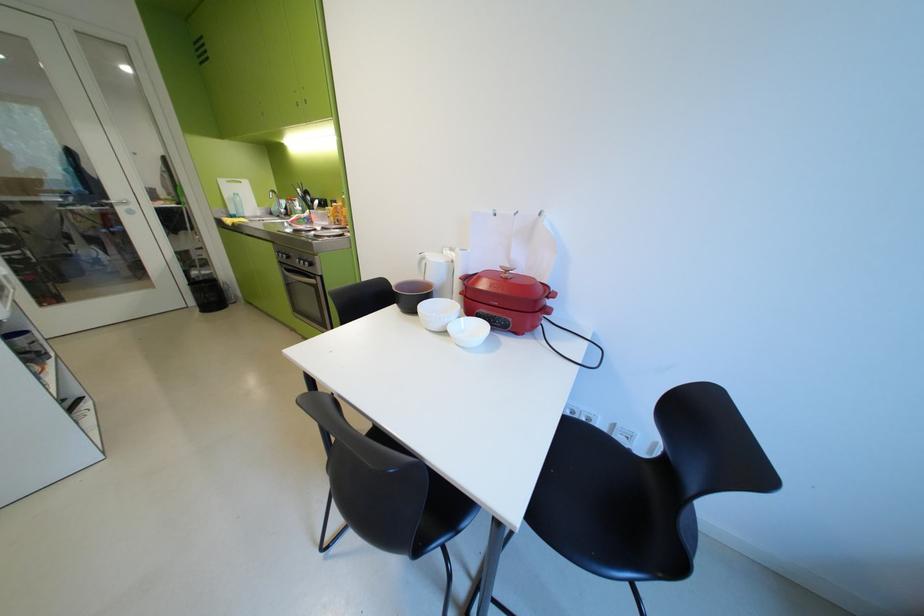
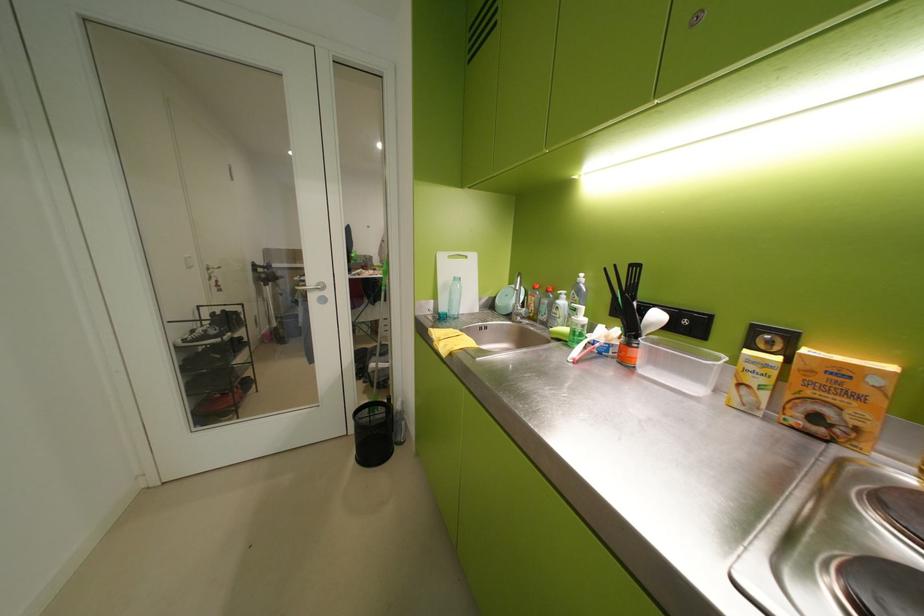
Where in the second image is the point corresponding to pixel 202 302 from the first image?

(363, 432)